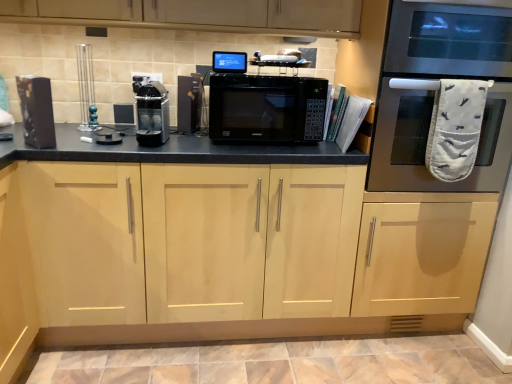
What do you see at coordinates (36, 111) in the screenshot?
I see `black matte speaker at left, which is counted as the first appliance, starting from the left` at bounding box center [36, 111].

Describe the element at coordinates (439, 92) in the screenshot. I see `stainless steel oven at right` at that location.

What are the coordinates of `black plastic coffee machine at center, which ranks as the 2th appliance in left-to-right order` in the screenshot? It's located at pyautogui.click(x=152, y=115).

In order to face black plastic coffee machine at center, placed as the 2th appliance when sorted from right to left, should I rotate leftwards or rightwards?

It's best to rotate left around 13.783 degrees.

Locate an element on the screen. Image resolution: width=512 pixels, height=384 pixels. black matte microwave at center is located at coordinates (267, 108).

Which of these two, black matte speaker at left, arranged as the 3th appliance when viewed from the right, or black plastic toaster at center, which is the 3th appliance in left-to-right order, is wider?

black plastic toaster at center, which is the 3th appliance in left-to-right order, is wider.

Is there a large distance between black matte speaker at left, which is counted as the first appliance, starting from the left, and black plastic toaster at center, acting as the 1th appliance starting from the right?

They are positioned close to each other.

Based on the photo, from a real-world perspective, who is located higher, black matte speaker at left, which is counted as the first appliance, starting from the left, or black plastic toaster at center, which is the 3th appliance in left-to-right order?

black plastic toaster at center, which is the 3th appliance in left-to-right order.

Between black matte speaker at left, arranged as the 3th appliance when viewed from the right, and black plastic toaster at center, acting as the 1th appliance starting from the right, which one is positioned behind?

black plastic toaster at center, acting as the 1th appliance starting from the right, is behind.

Based on the photo, how far apart are black matte microwave at center and light wood cabinet at center?

A distance of 15.90 inches exists between black matte microwave at center and light wood cabinet at center.

Is black matte microwave at center at the right side of light wood cabinet at center?

Correct, you'll find black matte microwave at center to the right of light wood cabinet at center.

What's the angular difference between black matte microwave at center and light wood cabinet at center's facing directions?

The facing directions of black matte microwave at center and light wood cabinet at center are 0.421 degrees apart.

This screenshot has height=384, width=512. What are the coordinates of `cabinetry below the black matte microwave at center (from a real-world perspective)` in the screenshot? It's located at (195, 242).

Are light wood cabinet at center and black plastic toaster at center, acting as the 1th appliance starting from the right, beside each other?

No, light wood cabinet at center is not beside black plastic toaster at center, acting as the 1th appliance starting from the right.

Is light wood cabinet at center at the right side of black plastic toaster at center, which is the 3th appliance in left-to-right order?

Correct, you'll find light wood cabinet at center to the right of black plastic toaster at center, which is the 3th appliance in left-to-right order.

Is light wood cabinet at center facing away from black plastic toaster at center, acting as the 1th appliance starting from the right?

No, black plastic toaster at center, acting as the 1th appliance starting from the right, is not at the back of light wood cabinet at center.

Considering the sizes of light wood cabinet at center and black plastic toaster at center, which is the 3th appliance in left-to-right order, in the image, is light wood cabinet at center taller or shorter than black plastic toaster at center, which is the 3th appliance in left-to-right order,?

light wood cabinet at center is taller than black plastic toaster at center, which is the 3th appliance in left-to-right order.

Can you confirm if light wood cabinet at center is positioned to the left of black plastic coffee machine at center, which ranks as the 2th appliance in left-to-right order?

In fact, light wood cabinet at center is to the right of black plastic coffee machine at center, which ranks as the 2th appliance in left-to-right order.

Who is shorter, light wood cabinet at center or black plastic coffee machine at center, placed as the 2th appliance when sorted from right to left?

Standing shorter between the two is black plastic coffee machine at center, placed as the 2th appliance when sorted from right to left.

What's the angular difference between light wood cabinet at center and black plastic coffee machine at center, placed as the 2th appliance when sorted from right to left,'s facing directions?

The angular difference between light wood cabinet at center and black plastic coffee machine at center, placed as the 2th appliance when sorted from right to left, is 3.51 degrees.

Could you tell me if light wood cabinet at center is turned towards black plastic coffee machine at center, placed as the 2th appliance when sorted from right to left?

No.

How much distance is there between stainless steel oven at right and black plastic coffee machine at center, placed as the 2th appliance when sorted from right to left?

The distance of stainless steel oven at right from black plastic coffee machine at center, placed as the 2th appliance when sorted from right to left, is 1.17 meters.

Between stainless steel oven at right and black plastic coffee machine at center, which ranks as the 2th appliance in left-to-right order, which one appears on the left side from the viewer's perspective?

black plastic coffee machine at center, which ranks as the 2th appliance in left-to-right order.

Do you think stainless steel oven at right is within black plastic coffee machine at center, which ranks as the 2th appliance in left-to-right order, or outside of it?

stainless steel oven at right lies outside black plastic coffee machine at center, which ranks as the 2th appliance in left-to-right order.

From the image's perspective, is stainless steel oven at right beneath black plastic coffee machine at center, placed as the 2th appliance when sorted from right to left?

Actually, stainless steel oven at right appears above black plastic coffee machine at center, placed as the 2th appliance when sorted from right to left, in the image.

Is black plastic coffee machine at center, which ranks as the 2th appliance in left-to-right order, at the right side of light wood cabinet at center?

Incorrect, black plastic coffee machine at center, which ranks as the 2th appliance in left-to-right order, is not on the right side of light wood cabinet at center.

Is black plastic coffee machine at center, placed as the 2th appliance when sorted from right to left, with light wood cabinet at center?

black plastic coffee machine at center, placed as the 2th appliance when sorted from right to left, and light wood cabinet at center are clearly separated.

Can you tell me how much black plastic coffee machine at center, placed as the 2th appliance when sorted from right to left, and light wood cabinet at center differ in facing direction?

black plastic coffee machine at center, placed as the 2th appliance when sorted from right to left, and light wood cabinet at center are facing 3.51 degrees away from each other.

Between black plastic coffee machine at center, which ranks as the 2th appliance in left-to-right order, and light wood cabinet at center, which one has smaller size?

With smaller size is black plastic coffee machine at center, which ranks as the 2th appliance in left-to-right order.

Considering the sizes of objects black matte speaker at left, which is counted as the first appliance, starting from the left, and black plastic coffee machine at center, placed as the 2th appliance when sorted from right to left, in the image provided, who is bigger, black matte speaker at left, which is counted as the first appliance, starting from the left, or black plastic coffee machine at center, placed as the 2th appliance when sorted from right to left,?

With larger size is black plastic coffee machine at center, placed as the 2th appliance when sorted from right to left.

Could you tell me if black matte speaker at left, which is counted as the first appliance, starting from the left, is turned towards black plastic coffee machine at center, which ranks as the 2th appliance in left-to-right order?

No, black matte speaker at left, which is counted as the first appliance, starting from the left, is not facing towards black plastic coffee machine at center, which ranks as the 2th appliance in left-to-right order.

From a real-world perspective, is black matte speaker at left, arranged as the 3th appliance when viewed from the right, over black plastic coffee machine at center, which ranks as the 2th appliance in left-to-right order?

Yes.

From the image's perspective, is black matte speaker at left, arranged as the 3th appliance when viewed from the right, above black plastic coffee machine at center, placed as the 2th appliance when sorted from right to left?

Actually, black matte speaker at left, arranged as the 3th appliance when viewed from the right, appears below black plastic coffee machine at center, placed as the 2th appliance when sorted from right to left, in the image.

This screenshot has width=512, height=384. Find the location of `the 2nd appliance counting from the right side of the black matte speaker at left, which is counted as the first appliance, starting from the left`. the 2nd appliance counting from the right side of the black matte speaker at left, which is counted as the first appliance, starting from the left is located at coordinates (189, 103).

Locate an element on the screen. cabinetry lying below the black matte microwave at center (from the image's perspective) is located at coordinates (195, 242).

Looking at the image, which one is located further to black matte microwave at center, stainless steel oven at right or black plastic toaster at center, acting as the 1th appliance starting from the right?

stainless steel oven at right is further to black matte microwave at center.

Estimate the real-world distances between objects in this image. Which object is closer to black matte microwave at center, light wood cabinet at center or black plastic toaster at center, which is the 3th appliance in left-to-right order?

black plastic toaster at center, which is the 3th appliance in left-to-right order, is closer to black matte microwave at center.

Which object lies nearer to the anchor point black plastic coffee machine at center, which ranks as the 2th appliance in left-to-right order, light wood cabinet at center or stainless steel oven at right?

The object closer to black plastic coffee machine at center, which ranks as the 2th appliance in left-to-right order, is light wood cabinet at center.

Looking at the image, which one is located closer to black matte speaker at left, which is counted as the first appliance, starting from the left, black plastic toaster at center, acting as the 1th appliance starting from the right, or stainless steel oven at right?

black plastic toaster at center, acting as the 1th appliance starting from the right, lies closer to black matte speaker at left, which is counted as the first appliance, starting from the left, than the other object.

From the image, which object appears to be farther from black matte speaker at left, arranged as the 3th appliance when viewed from the right, stainless steel oven at right or light wood cabinet at center?

stainless steel oven at right is further to black matte speaker at left, arranged as the 3th appliance when viewed from the right.

Looking at the image, which one is located closer to black plastic toaster at center, acting as the 1th appliance starting from the right, stainless steel oven at right or black matte microwave at center?

black matte microwave at center is closer to black plastic toaster at center, acting as the 1th appliance starting from the right.

Which object lies nearer to the anchor point black matte microwave at center, black plastic coffee machine at center, placed as the 2th appliance when sorted from right to left, or black plastic toaster at center, which is the 3th appliance in left-to-right order?

black plastic coffee machine at center, placed as the 2th appliance when sorted from right to left.

Which object lies nearer to the anchor point stainless steel oven at right, light wood cabinet at center or black plastic coffee machine at center, placed as the 2th appliance when sorted from right to left?

light wood cabinet at center lies closer to stainless steel oven at right than the other object.

Identify the location of cabinetry situated between black matte speaker at left, arranged as the 3th appliance when viewed from the right, and stainless steel oven at right from left to right. (195, 242).

Find the location of a particular element. This screenshot has height=384, width=512. cabinetry between black matte speaker at left, arranged as the 3th appliance when viewed from the right, and black matte microwave at center from left to right is located at coordinates (195, 242).

What are the coordinates of `appliance between black plastic coffee machine at center, placed as the 2th appliance when sorted from right to left, and stainless steel oven at right from left to right` in the screenshot? It's located at (189, 103).

Where is `microwave oven between black plastic toaster at center, acting as the 1th appliance starting from the right, and light wood cabinet at center, in the vertical direction`? microwave oven between black plastic toaster at center, acting as the 1th appliance starting from the right, and light wood cabinet at center, in the vertical direction is located at coordinates (267, 108).